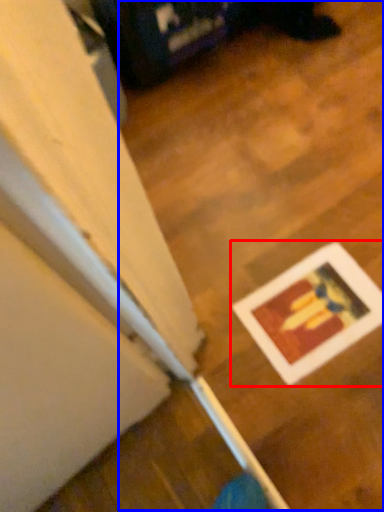
Question: Which of the following is the closest to the observer, picture frame (highlighted by a red box) or wood (highlighted by a blue box)?

Choices:
 (A) picture frame
 (B) wood

Answer: (B)